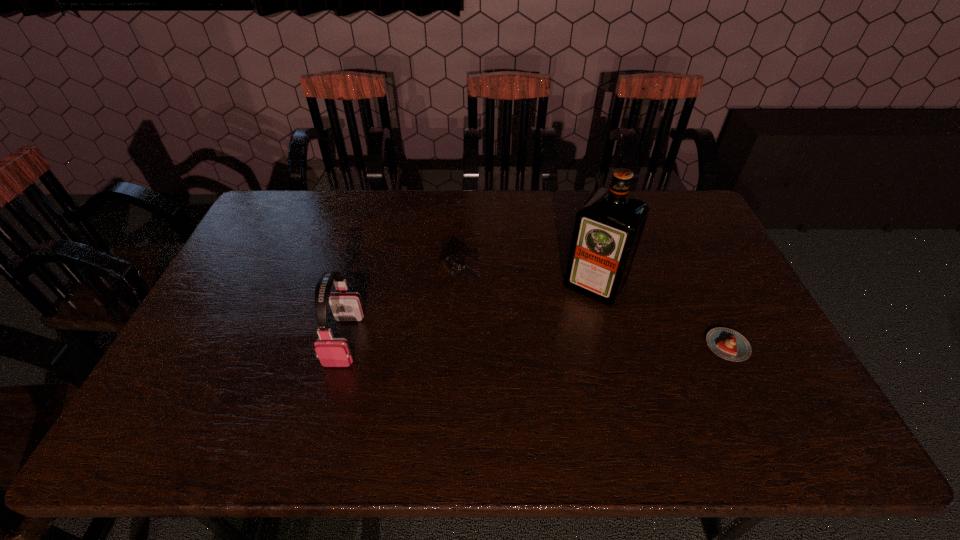
The width and height of the screenshot is (960, 540). I want to click on earphone, so click(x=332, y=352).

Where is `the second tallest object`? This screenshot has height=540, width=960. the second tallest object is located at coordinates (332, 352).

Where is `the shortest object`? Image resolution: width=960 pixels, height=540 pixels. the shortest object is located at coordinates (728, 344).

This screenshot has height=540, width=960. What are the coordinates of `pastry` in the screenshot? It's located at (728, 344).

You are a GUI agent. You are given a task and a screenshot of the screen. Output one action in this format:
    pyautogui.click(x=<x>, y=<y>)
    Task: Click on the pistol
    
    Given the screenshot: What is the action you would take?
    pyautogui.click(x=448, y=265)

Identify the location of the second shortest object. (448, 265).

Find the location of a particular element. The width and height of the screenshot is (960, 540). the tallest object is located at coordinates (608, 227).

Where is `liquor`? Image resolution: width=960 pixels, height=540 pixels. liquor is located at coordinates (608, 227).

The width and height of the screenshot is (960, 540). In order to click on free space located on the left of the rightmost object in this screenshot , I will do `click(658, 346)`.

Where is `blank area located at the barrel of the pistol`? The height and width of the screenshot is (540, 960). blank area located at the barrel of the pistol is located at coordinates (501, 312).